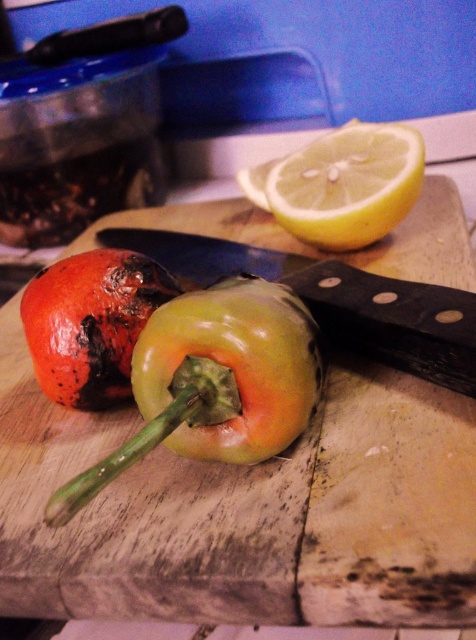
Measure the distance between point (373, 304) and camera.

Point (373, 304) is 1.08 meters from camera.

Can you confirm if black plastic knife at center is thinner than yellow matte lemon at upper center?

No.

This screenshot has width=476, height=640. What do you see at coordinates (337, 300) in the screenshot? I see `black plastic knife at center` at bounding box center [337, 300].

Locate an element on the screen. The image size is (476, 640). black plastic knife at center is located at coordinates (337, 300).

Who is shorter, wooden cutting board at center or black plastic knife at center?

With less height is black plastic knife at center.

Who is higher up, wooden cutting board at center or black plastic knife at center?

black plastic knife at center

The height and width of the screenshot is (640, 476). In order to click on wooden cutting board at center in this screenshot , I will do coord(247,513).

Which is above, wooden cutting board at center or yellow matte lemon at upper center?

yellow matte lemon at upper center

Can you confirm if wooden cutting board at center is bigger than yellow matte lemon at upper center?

Correct, wooden cutting board at center is larger in size than yellow matte lemon at upper center.

Which is in front, point (119, 560) or point (340, 179)?

Point (119, 560) is in front.

The height and width of the screenshot is (640, 476). I want to click on wooden cutting board at center, so click(x=247, y=513).